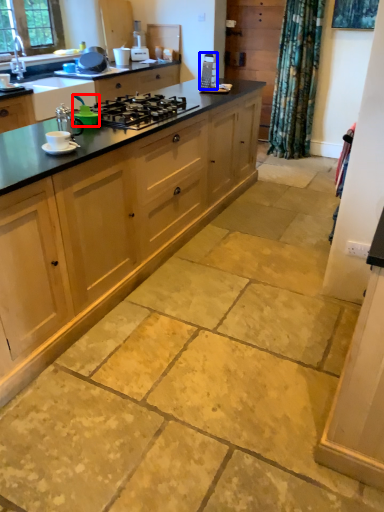
Question: Which of the following is the farthest to the observer, appliance (highlighted by a red box) or appliance (highlighted by a blue box)?

Choices:
 (A) appliance
 (B) appliance

Answer: (B)